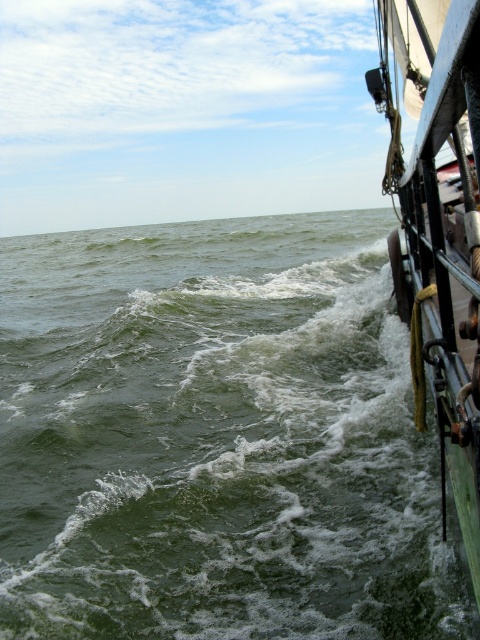
Which of these two, green frothy water at lower left or green matte sailboat at right, stands taller?

Standing taller between the two is green matte sailboat at right.

What do you see at coordinates (216, 436) in the screenshot? This screenshot has width=480, height=640. I see `green frothy water at lower left` at bounding box center [216, 436].

Where is `green frothy water at lower left`? This screenshot has width=480, height=640. green frothy water at lower left is located at coordinates (216, 436).